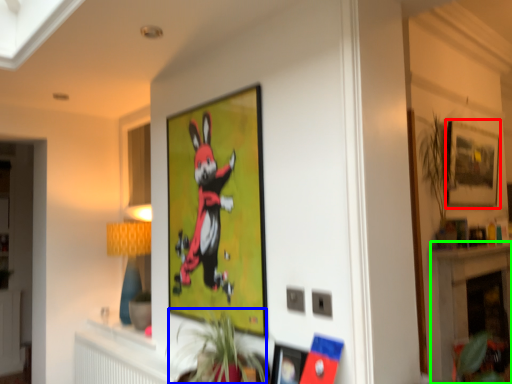
Question: Which is nearer to the picture frame (highlighted by a red box)? plant (highlighted by a blue box) or fireplace (highlighted by a green box).

Choices:
 (A) plant
 (B) fireplace

Answer: (B)